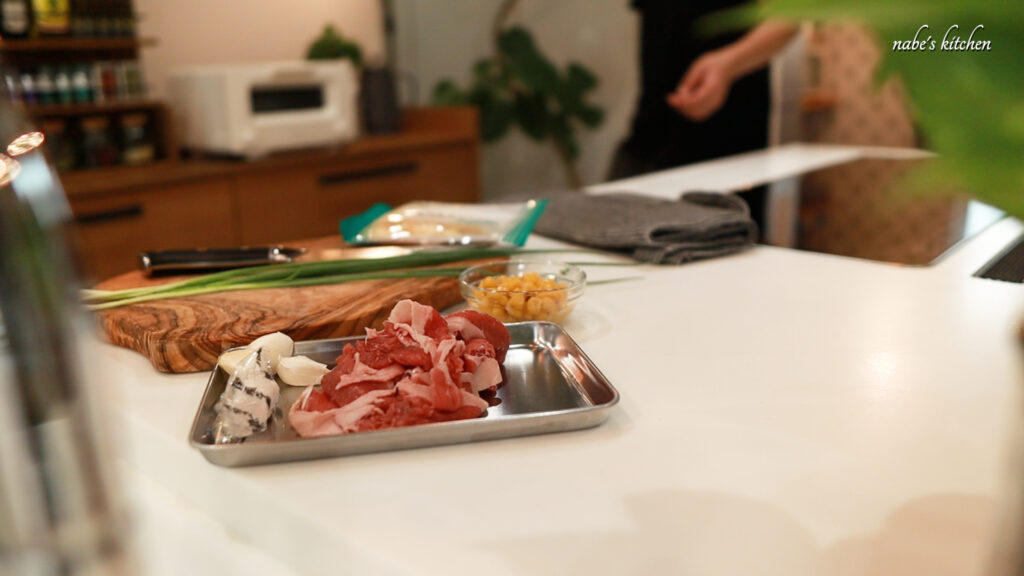
Identify the location of white appliance. (250, 109).